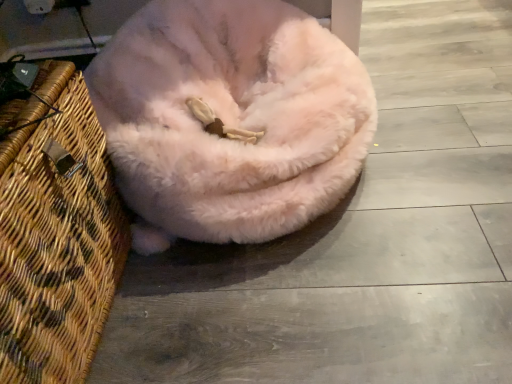
Find the location of `pink fluffy dog bed at center`. pink fluffy dog bed at center is located at coordinates (230, 119).

What do you see at coordinates (230, 119) in the screenshot? This screenshot has height=384, width=512. I see `pink fluffy dog bed at center` at bounding box center [230, 119].

The height and width of the screenshot is (384, 512). Describe the element at coordinates (56, 232) in the screenshot. I see `woven wood basket at left` at that location.

Find the location of a particular element. The image size is (512, 384). woven wood basket at left is located at coordinates (56, 232).

Locate an element on the screen. The width and height of the screenshot is (512, 384). pink fluffy dog bed at center is located at coordinates (230, 119).

Can you confirm if pink fluffy dog bed at center is positioned to the right of woven wood basket at left?

Yes, pink fluffy dog bed at center is to the right of woven wood basket at left.

Is pink fluffy dog bed at center further to the viewer compared to woven wood basket at left?

Yes, pink fluffy dog bed at center is further from the camera.

Does point (240, 166) come behind point (40, 322)?

Yes.

From the image's perspective, is pink fluffy dog bed at center under woven wood basket at left?

No, from the image's perspective, pink fluffy dog bed at center is not beneath woven wood basket at left.

From a real-world perspective, which object stands above the other?

woven wood basket at left, from a real-world perspective.

Considering the sizes of pink fluffy dog bed at center and woven wood basket at left in the image, is pink fluffy dog bed at center wider or thinner than woven wood basket at left?

pink fluffy dog bed at center is wider than woven wood basket at left.

Based on the photo, in terms of height, does pink fluffy dog bed at center look taller or shorter compared to woven wood basket at left?

pink fluffy dog bed at center is shorter than woven wood basket at left.

Considering the relative sizes of pink fluffy dog bed at center and woven wood basket at left in the image provided, is pink fluffy dog bed at center smaller than woven wood basket at left?

No, pink fluffy dog bed at center is not smaller than woven wood basket at left.

Would you say pink fluffy dog bed at center is inside or outside woven wood basket at left?

pink fluffy dog bed at center exists outside the volume of woven wood basket at left.

Does pink fluffy dog bed at center touch woven wood basket at left?

No, pink fluffy dog bed at center is not touching woven wood basket at left.

Is pink fluffy dog bed at center positioned with its back to woven wood basket at left?

No, pink fluffy dog bed at center is not facing away from woven wood basket at left.

How many degrees apart are the facing directions of pink fluffy dog bed at center and woven wood basket at left?

The angular difference between pink fluffy dog bed at center and woven wood basket at left is 90 degrees.

Where is `dog bed behind the woven wood basket at left`? Image resolution: width=512 pixels, height=384 pixels. dog bed behind the woven wood basket at left is located at coordinates (230, 119).

Is woven wood basket at left to the left or to the right of pink fluffy dog bed at center in the image?

woven wood basket at left is positioned on pink fluffy dog bed at center's left side.

Between woven wood basket at left and pink fluffy dog bed at center, which one is positioned behind?

pink fluffy dog bed at center is behind.

Which point is more distant from viewer, [49,269] or [333,122]?

The point [333,122] is farther.

From the image's perspective, which one is positioned higher, woven wood basket at left or pink fluffy dog bed at center?

From the image's view, pink fluffy dog bed at center is above.

Looking at this image, from a real-world perspective, is woven wood basket at left physically located above or below pink fluffy dog bed at center?

In terms of real-world spatial position, woven wood basket at left is above pink fluffy dog bed at center.

Is woven wood basket at left wider than pink fluffy dog bed at center?

Incorrect, the width of woven wood basket at left does not surpass that of pink fluffy dog bed at center.

Considering the sizes of objects woven wood basket at left and pink fluffy dog bed at center in the image provided, who is shorter, woven wood basket at left or pink fluffy dog bed at center?

With less height is pink fluffy dog bed at center.

Considering the sizes of objects woven wood basket at left and pink fluffy dog bed at center in the image provided, who is bigger, woven wood basket at left or pink fluffy dog bed at center?

With larger size is pink fluffy dog bed at center.

Which is correct: woven wood basket at left is inside pink fluffy dog bed at center, or outside of it?

woven wood basket at left is located beyond the bounds of pink fluffy dog bed at center.

Would you say woven wood basket at left is a long distance from pink fluffy dog bed at center?

No, there isn't a large distance between woven wood basket at left and pink fluffy dog bed at center.

Is woven wood basket at left turned away from pink fluffy dog bed at center?

No.

At what (x,y) coordinates should I click in order to perform the action: click on dog bed behind the woven wood basket at left. Please return your answer as a coordinate pair (x, y). Image resolution: width=512 pixels, height=384 pixels. Looking at the image, I should click on (230, 119).

Locate an element on the screen. The image size is (512, 384). dog bed below the woven wood basket at left (from a real-world perspective) is located at coordinates (230, 119).

The height and width of the screenshot is (384, 512). In the image, there is a pink fluffy dog bed at center. What are the coordinates of `basket below it (from the image's perspective)` in the screenshot? It's located at pos(56,232).